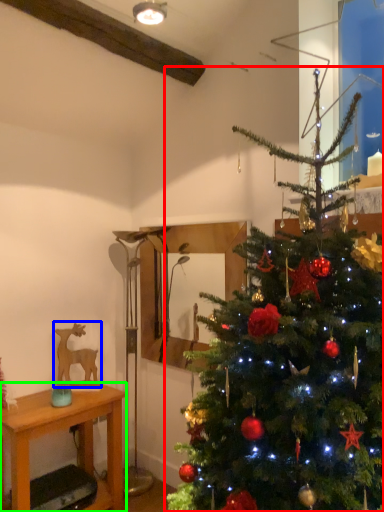
Question: Considering the real-world distances, which object is farthest from christmas tree (highlighted by a red box)? animal (highlighted by a blue box) or desk (highlighted by a green box)?

Choices:
 (A) animal
 (B) desk

Answer: (A)